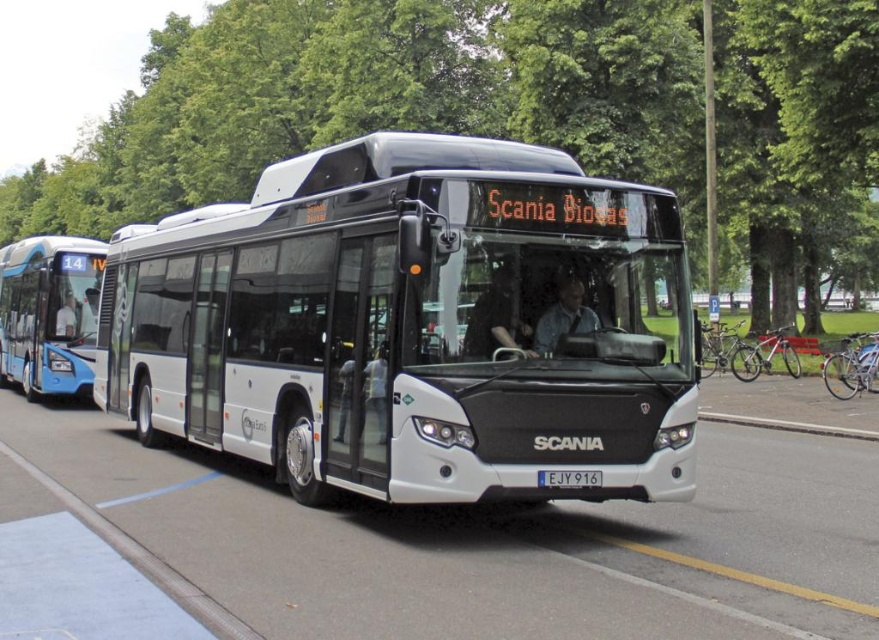
You are standing at the origin point of the coordinate system. Where is the blue glossy bus at left located in terms of coordinates?

The blue glossy bus at left is located at coordinates point (49,314).

You are standing at the point marked by the coordinates (x=514, y=116) in the image. What object are you directly at?

You are directly at the green leafy tree at upper center, as the point (x=514, y=116) represents its location.